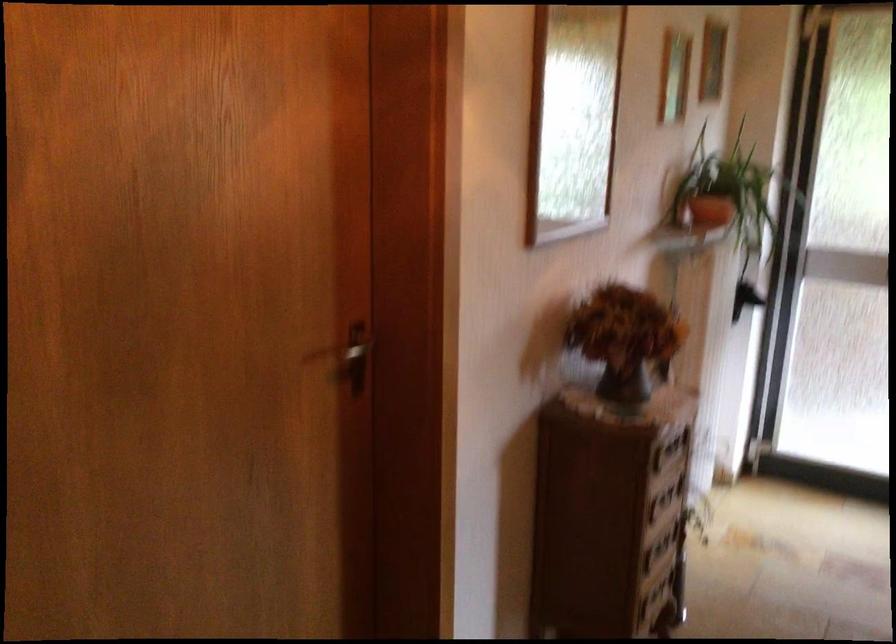
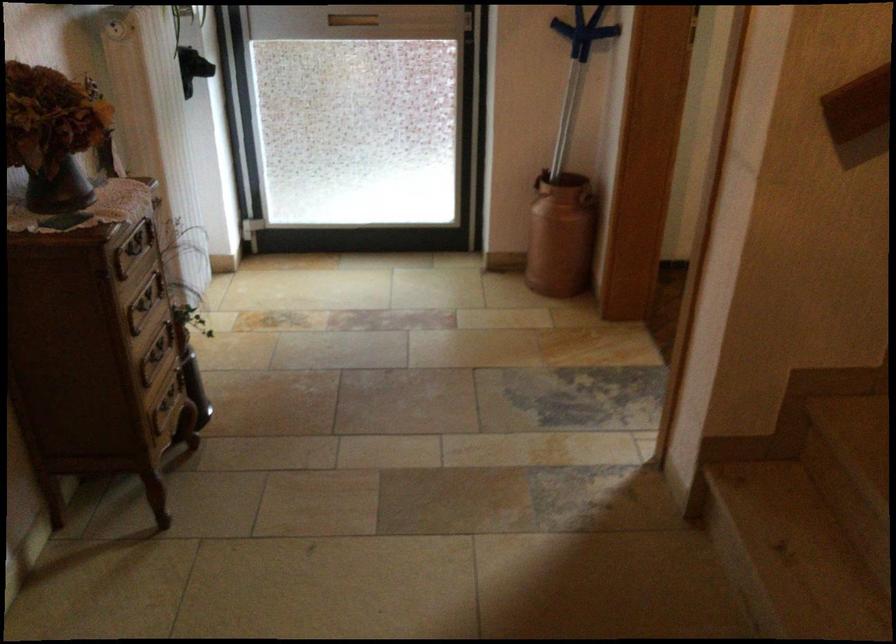
The point at (666, 500) is marked in the first image. Where is the corresponding point in the second image?

(144, 303)